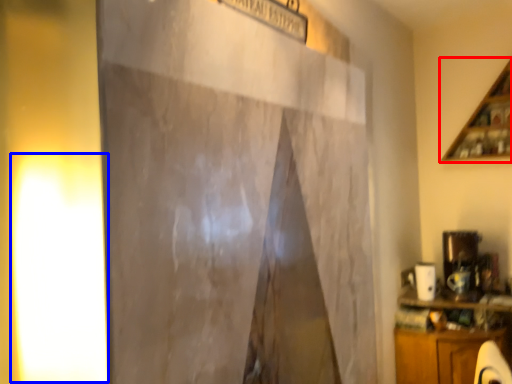
Question: Which point is closer to the camera, shelf (highlighted by a red box) or light (highlighted by a blue box)?

Choices:
 (A) shelf
 (B) light

Answer: (B)